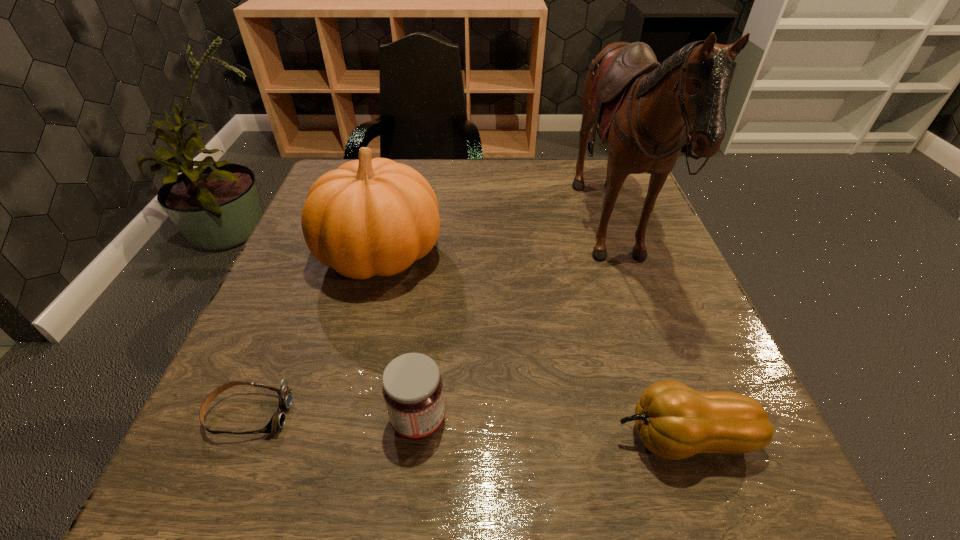
Image resolution: width=960 pixels, height=540 pixels. I want to click on saddle, so click(x=644, y=109).

The width and height of the screenshot is (960, 540). What are the coordinates of `the fourth shortest object` in the screenshot? It's located at (369, 217).

Identify the location of jam. The image size is (960, 540). (412, 387).

Where is `gourd`? The height and width of the screenshot is (540, 960). gourd is located at coordinates (674, 421).

Image resolution: width=960 pixels, height=540 pixels. Identify the location of the shortest object. (277, 421).

This screenshot has width=960, height=540. Identify the location of free spot located on the back of the tallest object. (519, 237).

Where is `free location located 0.270m on the back of the tallest object`? This screenshot has width=960, height=540. free location located 0.270m on the back of the tallest object is located at coordinates (457, 237).

You are a GUI agent. You are given a task and a screenshot of the screen. Output one action in this format:
    pyautogui.click(x=<x>, y=<y>)
    Task: Click on the free space located 0.310m on the back of the tallest object
    The height and width of the screenshot is (540, 960).
    Given the screenshot: What is the action you would take?
    pyautogui.click(x=439, y=237)

The height and width of the screenshot is (540, 960). I want to click on vacant space situated 0.190m on the right of the pumpkin, so click(x=532, y=255).

Locate an element on the screen. The image size is (960, 540). vacant space located 0.400m on the right of the jam is located at coordinates (714, 420).